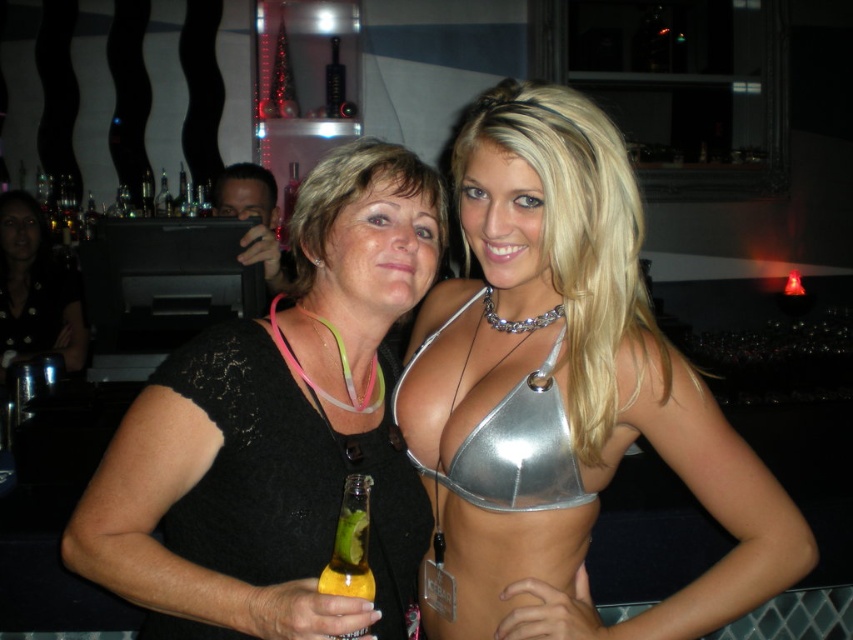
From the picture: Is metallic silver bikini top at center taller than translucent yellow glass bottle at lower left?

Correct, metallic silver bikini top at center is much taller as translucent yellow glass bottle at lower left.

Is metallic silver bikini top at center shorter than translucent yellow glass bottle at lower left?

No.

Who is more forward, (531, 380) or (370, 586)?

Point (370, 586)

This screenshot has width=853, height=640. Find the location of `metallic silver bikini top at center`. metallic silver bikini top at center is located at coordinates (517, 451).

In the scene shown: Who is more forward, (19, 316) or (357, 634)?

Point (357, 634)

Is point (4, 232) positioned behind point (370, 577)?

That is True.

Locate an element on the screen. The width and height of the screenshot is (853, 640). black fabric shirt at center is located at coordinates (35, 289).

Is the position of metallic silver top at center less distant than that of black lace top at center?

No.

Consider the image. How much distance is there between metallic silver top at center and black lace top at center?

A distance of 7.57 inches exists between metallic silver top at center and black lace top at center.

Does point (544, 291) come farther from viewer compared to point (289, 612)?

Yes, it is behind point (289, 612).

In order to click on metallic silver top at center in this screenshot , I will do `click(570, 385)`.